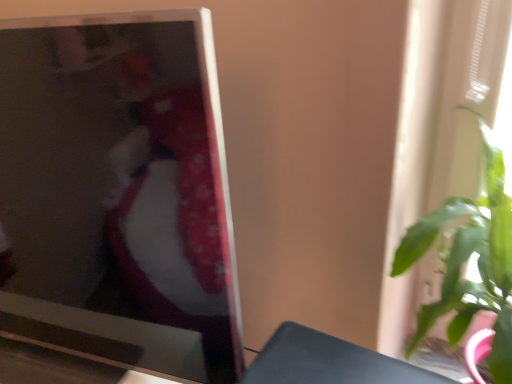
Describe the element at coordinates (118, 193) in the screenshot. I see `matte black television at left` at that location.

The image size is (512, 384). Find the location of `matte black television at left`. matte black television at left is located at coordinates (118, 193).

Locate an element on the screen. green leafy plant at right is located at coordinates (467, 260).

In the scene shown: What is the approximate width of green leafy plant at right?

The width of green leafy plant at right is 43.12 centimeters.

What do you see at coordinates (467, 260) in the screenshot? I see `green leafy plant at right` at bounding box center [467, 260].

This screenshot has width=512, height=384. Identify the location of matte black television at left. [118, 193].

Is matte black television at left to the right of green leafy plant at right from the viewer's perspective?

In fact, matte black television at left is to the left of green leafy plant at right.

Looking at this image, considering the relative positions of matte black television at left and green leafy plant at right in the image provided, is matte black television at left behind green leafy plant at right?

No.

Which is farther from the camera, (164, 141) or (445, 313)?

The point (445, 313) is more distant.

From the image's perspective, is matte black television at left above green leafy plant at right?

Correct, matte black television at left appears higher than green leafy plant at right in the image.

From a real-world perspective, is matte black television at left positioned above or below green leafy plant at right?

Clearly, from a real-world perspective, matte black television at left is above green leafy plant at right.

Does matte black television at left have a lesser width compared to green leafy plant at right?

Yes, matte black television at left is thinner than green leafy plant at right.

Is matte black television at left taller than green leafy plant at right?

Yes.

Is matte black television at left bigger than green leafy plant at right?

Indeed, matte black television at left has a larger size compared to green leafy plant at right.

Can green leafy plant at right be found inside matte black television at left?

No, green leafy plant at right is not a part of matte black television at left.

Is there a large distance between matte black television at left and green leafy plant at right?

Actually, matte black television at left and green leafy plant at right are a little close together.

Does matte black television at left turn towards green leafy plant at right?

No, matte black television at left is not turned towards green leafy plant at right.

How many degrees apart are the facing directions of matte black television at left and green leafy plant at right?

14.7 degrees.

What are the coordinates of `television lying in front of the green leafy plant at right` in the screenshot? It's located at (118, 193).

Can you confirm if green leafy plant at right is positioned to the left of matte black television at left?

No.

Is green leafy plant at right in front of or behind matte black television at left in the image?

green leafy plant at right is behind matte black television at left.

Which is closer to the camera, (471,216) or (163,305)?

Clearly, point (471,216) is more distant from the camera than point (163,305).

From the image's perspective, which one is positioned lower, green leafy plant at right or matte black television at left?

green leafy plant at right.

From a real-world perspective, is green leafy plant at right physically above matte black television at left?

No.

Considering the sizes of objects green leafy plant at right and matte black television at left in the image provided, who is thinner, green leafy plant at right or matte black television at left?

With smaller width is matte black television at left.

Considering the relative sizes of green leafy plant at right and matte black television at left in the image provided, is green leafy plant at right shorter than matte black television at left?

Yes.

Based on their sizes in the image, would you say green leafy plant at right is bigger or smaller than matte black television at left?

Clearly, green leafy plant at right is smaller in size than matte black television at left.

Is green leafy plant at right positioned beyond the bounds of matte black television at left?

That's correct, green leafy plant at right is outside of matte black television at left.

Is green leafy plant at right next to matte black television at left?

green leafy plant at right and matte black television at left are clearly separated.

Is green leafy plant at right facing towards matte black television at left?

No, green leafy plant at right is not aimed at matte black television at left.

Measure the distance between green leafy plant at right and matte black television at left.

19.04 inches.

Image resolution: width=512 pixels, height=384 pixels. Identify the location of television in front of the green leafy plant at right. (118, 193).

Locate an element on the screen. This screenshot has width=512, height=384. television on the left of the green leafy plant at right is located at coordinates (118, 193).

The width and height of the screenshot is (512, 384). In the image, there is a matte black television at left. Find the location of `houseplant below it (from a real-world perspective)`. houseplant below it (from a real-world perspective) is located at coordinates (467, 260).